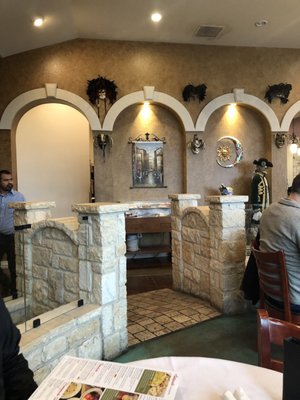
You are a GUI agent. You are given a task and a screenshot of the screen. Output one action in this format:
    pyautogui.click(x=<x>, y=<y>)
    Task: Click on the black pieces on wall
    The width and height of the screenshot is (300, 400).
    Given the screenshot: What is the action you would take?
    pyautogui.click(x=105, y=86), pyautogui.click(x=195, y=89), pyautogui.click(x=279, y=88)